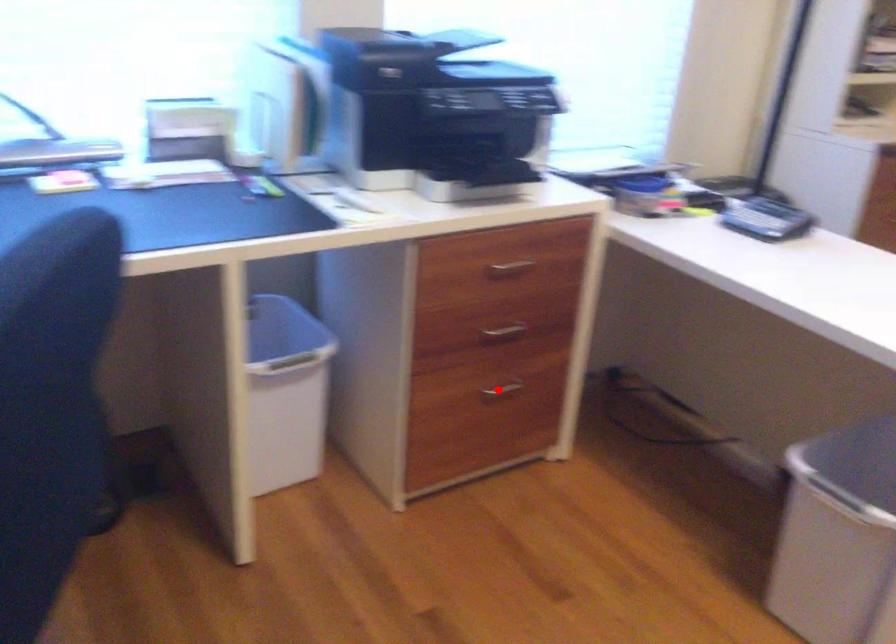
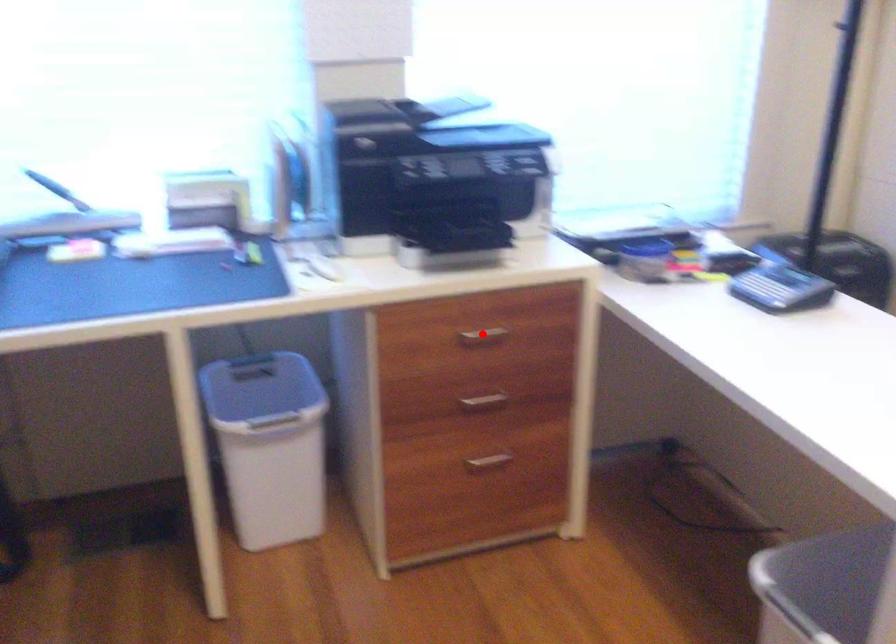
I am providing you with two images of the same scene from different viewpoints. A red point is marked on the first image and another point is marked on the second image. Does the point marked in image1 correspond to the same location as the one in image2?

No